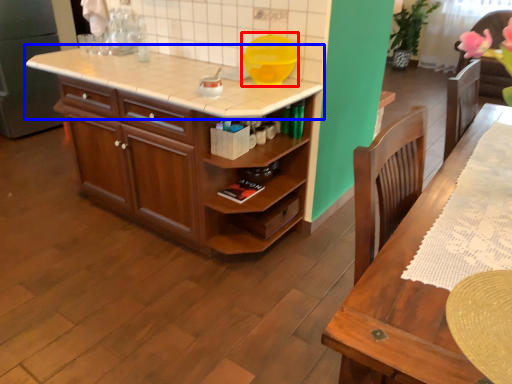
Question: Which object is closer to the camera taking this photo, appliance (highlighted by a red box) or countertop (highlighted by a blue box)?

Choices:
 (A) appliance
 (B) countertop

Answer: (B)